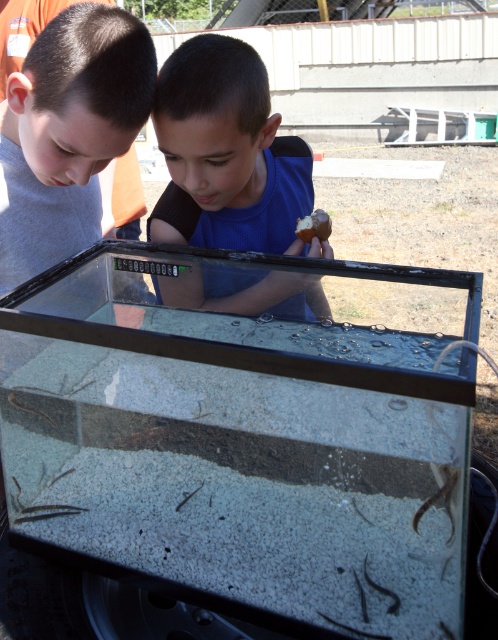
You are a photographer trying to capture a closeup of the brown matte potato at center. To do this, you need to position yourself so that the blue matte shirt at center is out of the frame. Given their positions, can you move to the right side of the aquarium to achieve this?

The blue matte shirt at center is to the left of the brown matte potato at center. By moving to the right side of the aquarium, you can position yourself so that the blue matte shirt at center is out of the frame, allowing you to capture a closeup of the brown matte potato at center.

You are a parent trying to ensure your child doesn not accidentally drop the brown matte potato at center into the transparent glass tank at center. Based on their positions, can you tell which object is closer to the edge of the tank?

The brown matte potato at center is to the right of the transparent glass tank at center, so the potato is closer to the edge of the tank.

You are a photographer trying to capture a clear photo of the brown matte potato at center. Since the blue matte shirt at center is blocking part of your view, can you move around to the left side to get a better shot?

The blue matte shirt at center is much taller than the brown matte potato at center, so moving to the left side might still allow you to see the brown matte potato at center over or around the blue matte shirt at center depending on their positions.